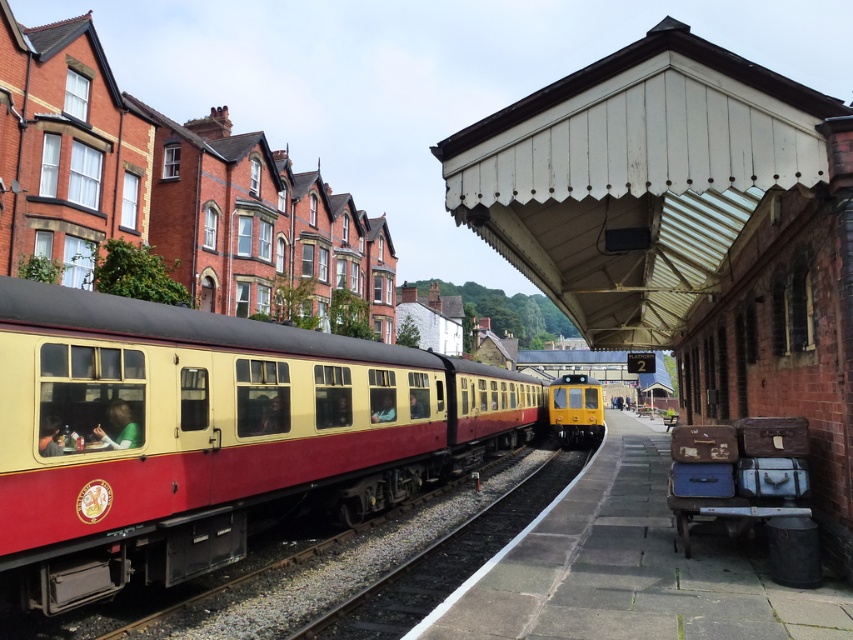
Question: Can you confirm if matte cream train at center is smaller than yellow matte train at center?

Choices:
 (A) yes
 (B) no

Answer: (A)

Question: Which of the following is the closest to the observer?

Choices:
 (A) yellow matte train at center
 (B) smooth metal train track at center

Answer: (B)

Question: Can you confirm if smooth metal train track at center is smaller than yellow matte train at center?

Choices:
 (A) no
 (B) yes

Answer: (B)

Question: Which object is positioned closest to the smooth metal train track at center?

Choices:
 (A) yellow matte train at center
 (B) matte cream train at center

Answer: (B)

Question: Which point is farther to the camera?

Choices:
 (A) (80, 445)
 (B) (590, 436)

Answer: (B)

Question: Where is matte cream train at center located in relation to smooth metal train track at center in the image?

Choices:
 (A) left
 (B) right

Answer: (A)